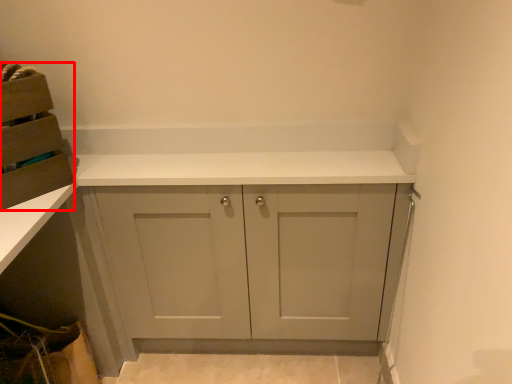
Question: From the image's perspective, where is cabinetry (annotated by the red box) located in relation to cabinetry in the image?

Choices:
 (A) below
 (B) above

Answer: (B)